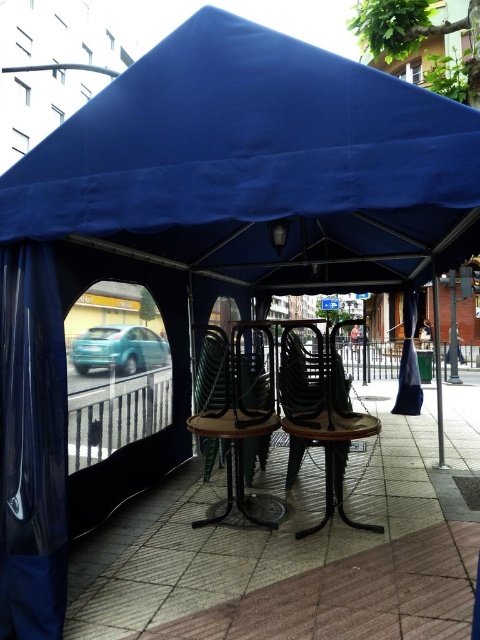
Which is in front, point (407, 256) or point (164, 637)?

Point (164, 637) is more forward.

You are a GUI agent. You are given a task and a screenshot of the screen. Output one action in this format:
    pyautogui.click(x=<x>, y=<y>)
    Task: Click on the blue fabric canopy at upper center
    The height and width of the screenshot is (640, 480).
    Given the screenshot: What is the action you would take?
    pyautogui.click(x=257, y=164)

Locate an element on the screen. The width and height of the screenshot is (480, 640). blue fabric canopy at upper center is located at coordinates (257, 164).

Can you confirm if smooth concrete pavement at center is bigger than metallic brown chair at center?

No, smooth concrete pavement at center is not bigger than metallic brown chair at center.

Which of these two, smooth concrete pavement at center or metallic brown chair at center, stands shorter?

smooth concrete pavement at center is shorter.

Describe the element at coordinates (301, 548) in the screenshot. I see `smooth concrete pavement at center` at that location.

This screenshot has width=480, height=640. What are the coordinates of `smooth concrete pavement at center` in the screenshot? It's located at [301, 548].

Can you confirm if blue fabric canopy at upper center is positioned to the right of wooden chair at center?

Incorrect, blue fabric canopy at upper center is not on the right side of wooden chair at center.

Between blue fabric canopy at upper center and wooden chair at center, which one appears on the left side from the viewer's perspective?

blue fabric canopy at upper center is more to the left.

Is point (450, 144) farther from camera compared to point (338, 456)?

No, it is in front of (338, 456).

Locate an element on the screen. This screenshot has height=640, width=480. blue fabric canopy at upper center is located at coordinates (257, 164).